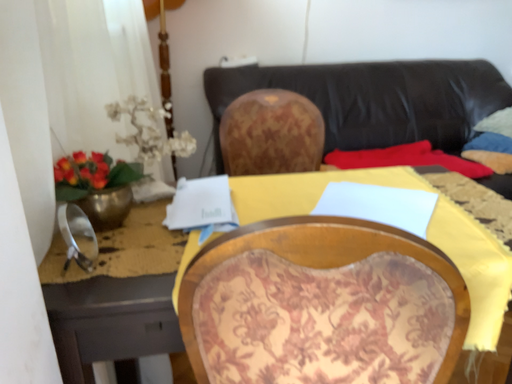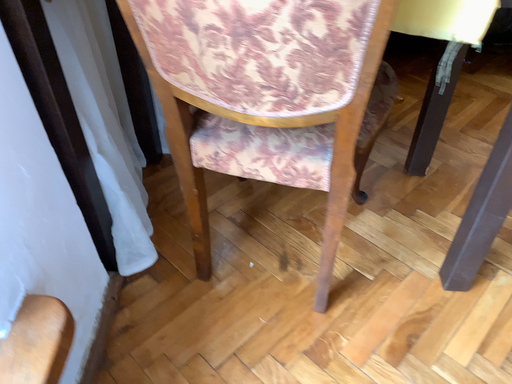
Question: Which way did the camera rotate in the video?

Choices:
 (A) rotated upward
 (B) rotated downward

Answer: (B)